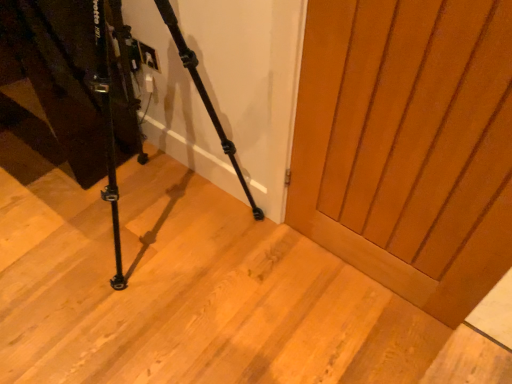
Question: Considering the relative positions of matte wood door at center and black matte tripod at lower left in the image provided, is matte wood door at center to the left or to the right of black matte tripod at lower left?

Choices:
 (A) left
 (B) right

Answer: (B)

Question: Is matte wood door at center bigger or smaller than black matte tripod at lower left?

Choices:
 (A) big
 (B) small

Answer: (B)

Question: Is point (339, 34) closer or farther from the camera than point (117, 233)?

Choices:
 (A) farther
 (B) closer

Answer: (B)

Question: Relative to matte wood door at center, is black matte tripod at lower left in front or behind?

Choices:
 (A) front
 (B) behind

Answer: (A)

Question: From the image's perspective, relative to matte wood door at center, is black matte tripod at lower left above or below?

Choices:
 (A) below
 (B) above

Answer: (B)

Question: From a real-world perspective, is black matte tripod at lower left above or below matte wood door at center?

Choices:
 (A) below
 (B) above

Answer: (B)

Question: Looking at the image, does black matte tripod at lower left seem bigger or smaller compared to matte wood door at center?

Choices:
 (A) big
 (B) small

Answer: (A)